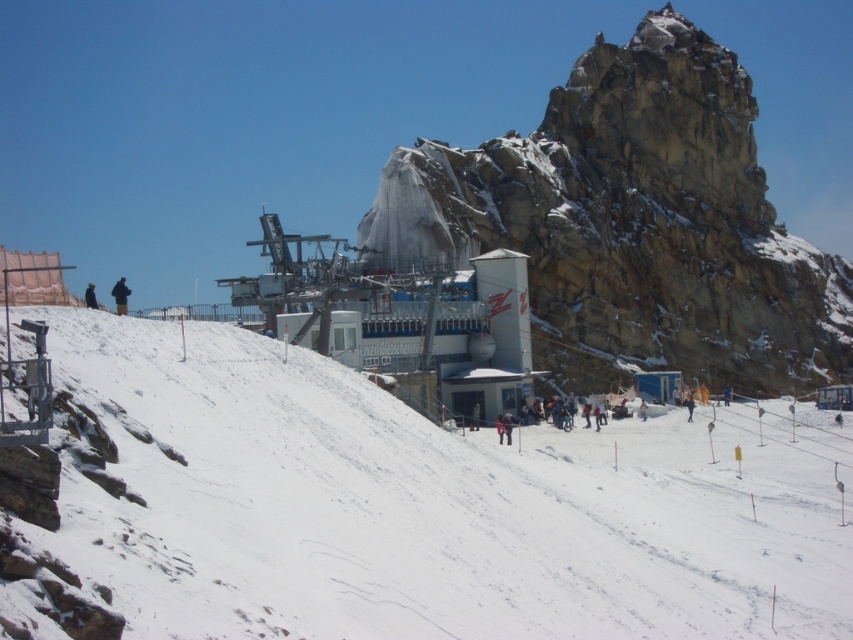
Looking at this image, is white snow at lower left wider than dark blue fabric at left?

No, white snow at lower left is not wider than dark blue fabric at left.

Is white snow at lower left positioned behind dark blue fabric at left?

No, it is in front of dark blue fabric at left.

Is point (149, 417) positioned in front of point (113, 291)?

Yes, it is.

This screenshot has width=853, height=640. Identify the location of white snow at lower left. pos(431,506).

Which of these two, dark blue jacket at lower left or dark blue jacket at lower right, stands taller?

Standing taller between the two is dark blue jacket at lower left.

Which is in front, point (88, 307) or point (691, 396)?

Point (88, 307)

Image resolution: width=853 pixels, height=640 pixels. I want to click on dark blue jacket at lower left, so click(x=90, y=296).

Between point (413, 614) and point (692, 396), which one is positioned in front?

Point (413, 614) is more forward.

Is point (541, 625) closer to viewer compared to point (689, 403)?

Yes, point (541, 625) is closer to viewer.

Is point (724, 605) positioned behind point (689, 419)?

No, (724, 605) is closer to viewer.

You are a GUI agent. You are given a task and a screenshot of the screen. Output one action in this format:
    pyautogui.click(x=<x>, y=<y>)
    Task: Click on the white snow at lower left
    
    Given the screenshot: What is the action you would take?
    pyautogui.click(x=431, y=506)